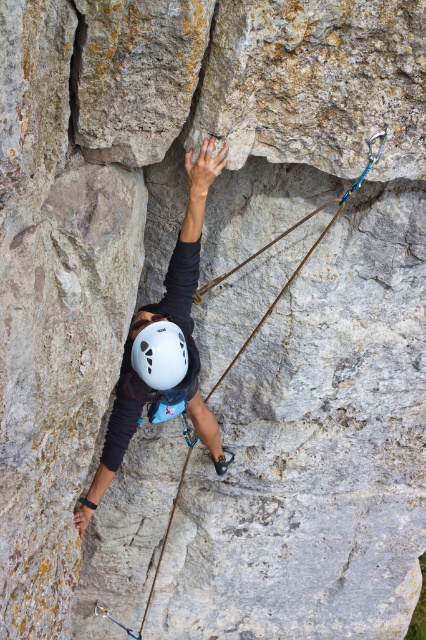
You are a rock climber assessing the climbing route. You see two points on the rock face labeled as point (x=371, y=157) and point (x=147, y=340). Which point is closer to you as you climb?

Point (x=371, y=157) is further to the viewer than point (x=147, y=340), so point (x=147, y=340) is closer to you as you climb.

You are a safety inspector observing the rock climber. You notice the matte white helmet at upper center and the brown rope at center. Which object is closer to the viewer?

The matte white helmet at upper center is closer to the viewer because it is in front of the brown rope at center.